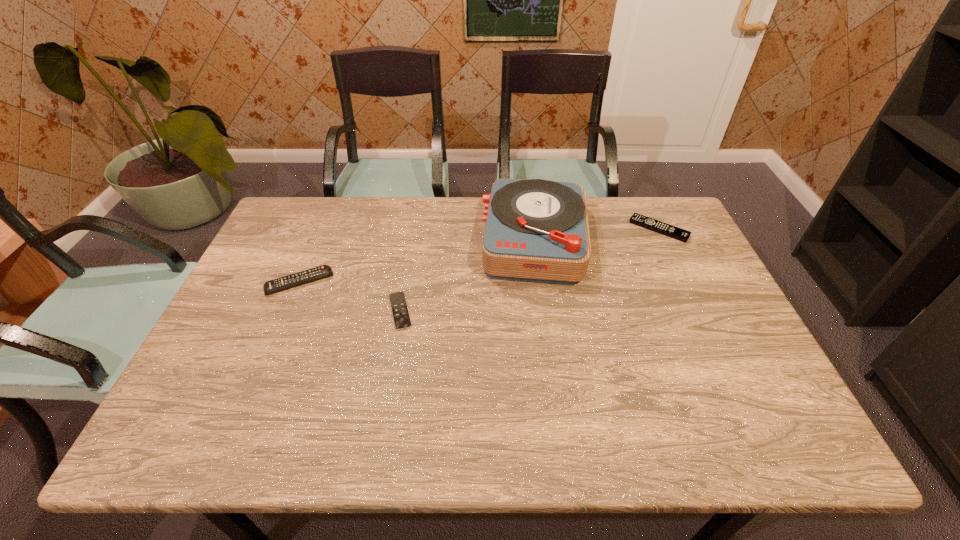
Locate an element on the screen. This screenshot has height=540, width=960. the second object from right to left is located at coordinates (536, 230).

At what (x,y) coordinates should I click in order to perform the action: click on record player. Please return your answer as a coordinate pair (x, y). Looking at the image, I should click on (536, 230).

This screenshot has width=960, height=540. Find the location of `the leftmost object`. the leftmost object is located at coordinates (289, 281).

Find the location of `the tallest remote control`. the tallest remote control is located at coordinates (289, 281).

Find the location of a particular element. This screenshot has width=960, height=540. the farthest remote control is located at coordinates (682, 235).

The width and height of the screenshot is (960, 540). Identify the location of the rightmost remote control. (682, 235).

Locate an element on the screen. the shortest remote control is located at coordinates (401, 317).

At what (x,y) coordinates should I click in order to perform the action: click on the second object from left to right. Please return your answer as a coordinate pair (x, y). Image resolution: width=960 pixels, height=540 pixels. Looking at the image, I should click on (401, 317).

The image size is (960, 540). In order to click on blank space located on the front of the second object from right to left in this screenshot , I will do `click(544, 306)`.

Find the location of a particular element. This screenshot has width=960, height=540. free space located 0.360m on the right of the leftmost remote control is located at coordinates (460, 282).